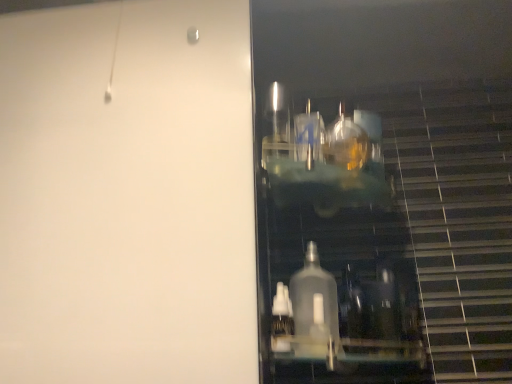
Question: Is transparent glass door at right placed right next to clear plastic bottle at lower center?

Choices:
 (A) yes
 (B) no

Answer: (B)

Question: Is transparent glass door at right to the left of clear plastic bottle at lower center from the viewer's perspective?

Choices:
 (A) no
 (B) yes

Answer: (B)

Question: From a real-world perspective, does transparent glass door at right sit lower than clear plastic bottle at lower center?

Choices:
 (A) yes
 (B) no

Answer: (B)

Question: Can you confirm if transparent glass door at right is taller than clear plastic bottle at lower center?

Choices:
 (A) yes
 (B) no

Answer: (A)

Question: Is clear plastic bottle at lower center at the back of transparent glass door at right?

Choices:
 (A) no
 (B) yes

Answer: (A)

Question: Is transparent glass door at right not near clear plastic bottle at lower center?

Choices:
 (A) no
 (B) yes

Answer: (A)

Question: Does clear plastic bottle at lower center have a smaller size compared to transparent glass door at right?

Choices:
 (A) yes
 (B) no

Answer: (A)

Question: From a real-world perspective, is clear plastic bottle at lower center located beneath transparent glass door at right?

Choices:
 (A) yes
 (B) no

Answer: (A)

Question: Can you confirm if clear plastic bottle at lower center is taller than transparent glass door at right?

Choices:
 (A) yes
 (B) no

Answer: (B)

Question: From the image's perspective, does clear plastic bottle at lower center appear lower than transparent glass door at right?

Choices:
 (A) yes
 (B) no

Answer: (A)

Question: Is clear plastic bottle at lower center wider than transparent glass door at right?

Choices:
 (A) no
 (B) yes

Answer: (A)

Question: From a real-world perspective, is clear plastic bottle at lower center located higher than transparent glass door at right?

Choices:
 (A) no
 (B) yes

Answer: (A)

Question: Can you confirm if clear plastic bottle at lower center is shorter than transparent plastic bottles at right?

Choices:
 (A) yes
 (B) no

Answer: (A)